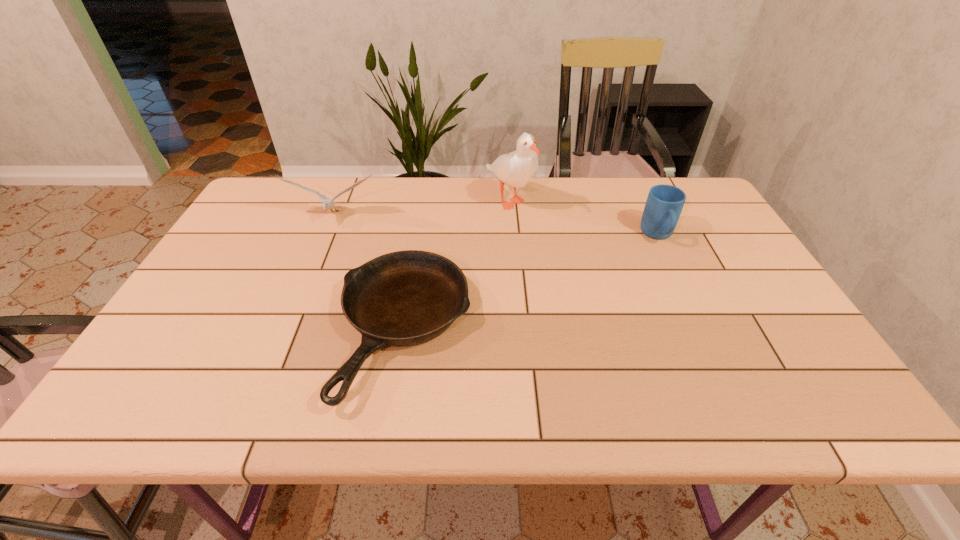
This screenshot has width=960, height=540. In order to click on vacant space that satisfies the following two spatial constraints: 1. at the tip of the beak of the shortest object; 2. on the right side of the shorter gull in this screenshot , I will do `click(287, 330)`.